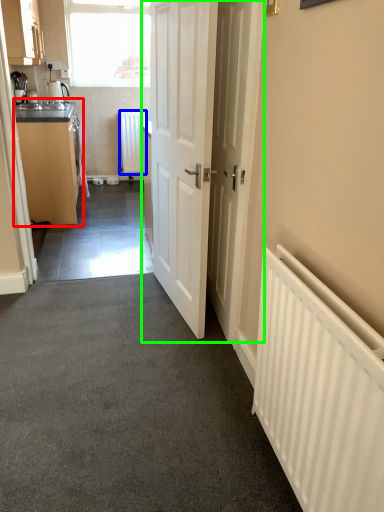
Question: Considering the real-world distances, which object is farthest from cabinetry (highlighted by a red box)? radiator (highlighted by a blue box) or door (highlighted by a green box)?

Choices:
 (A) radiator
 (B) door

Answer: (A)